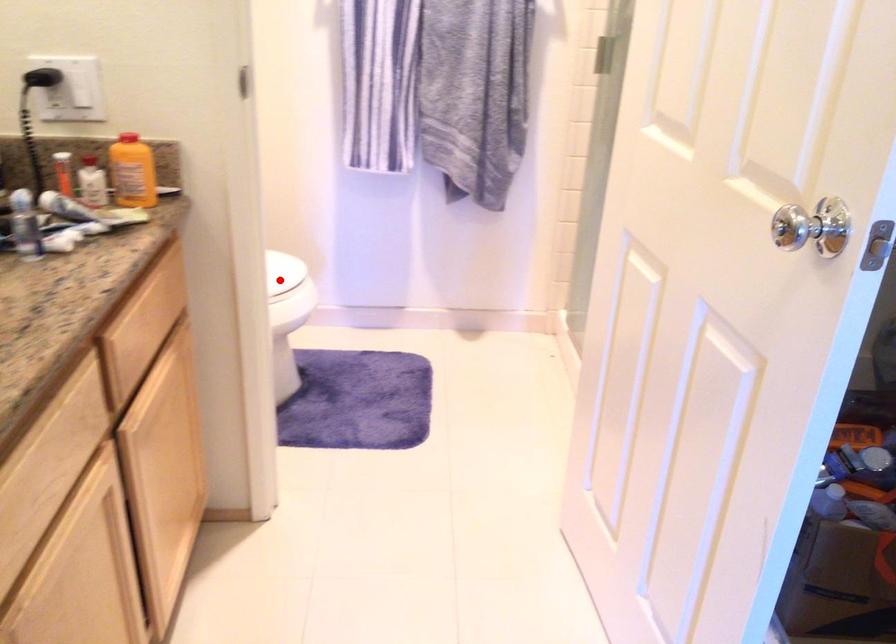
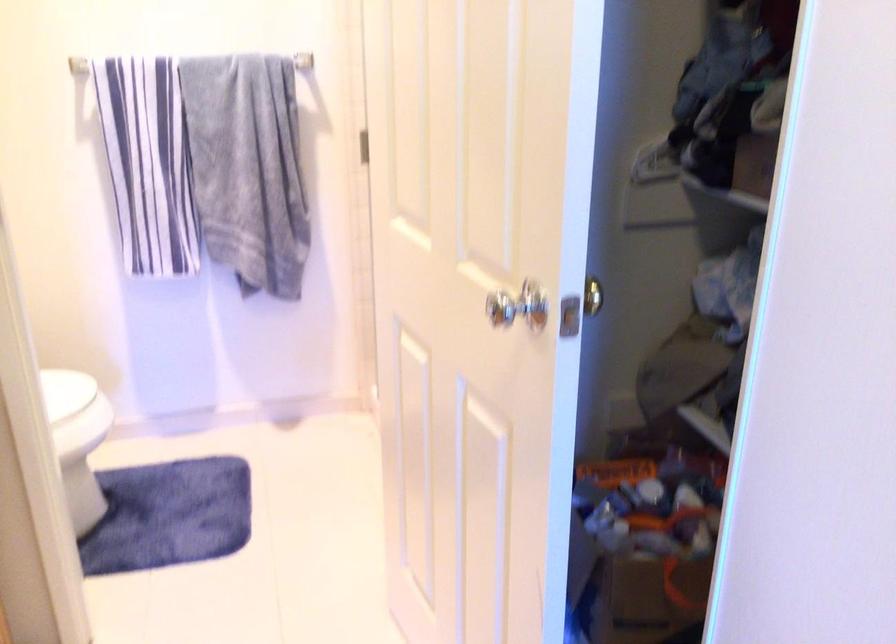
Locate, in the second image, the point that corresponds to the highlighted location in the first image.

(72, 400)